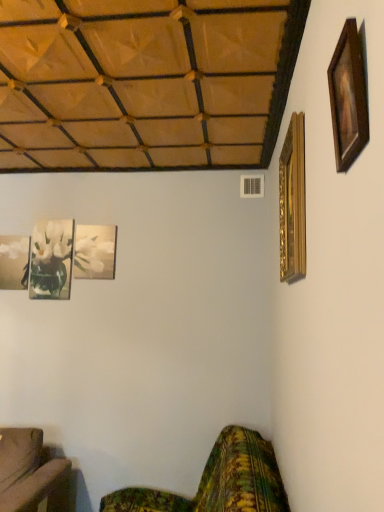
Question: From a real-world perspective, is green floral fabric couch at lower right physically located above or below matte glass picture frame at lower left, the second picture frame viewed from the left?

Choices:
 (A) below
 (B) above

Answer: (A)

Question: Looking at their shapes, would you say green floral fabric couch at lower right is wider or thinner than matte glass picture frame at lower left, the 2th picture frame from the back?

Choices:
 (A) wide
 (B) thin

Answer: (A)

Question: Based on their relative distances, which object is nearer to the matte glass picture frame at lower left, the second picture frame viewed from the left?

Choices:
 (A) wooden picture frame at upper right, which is counted as the fourth picture frame, starting from the left
 (B) matte glass vase at left, which appears as the first picture frame when viewed from the back
 (C) gold ornate picture frame at upper right, acting as the 5th picture frame starting from the left
 (D) white glossy picture frame at upper left, placed as the third picture frame when sorted from right to left
 (E) green floral fabric couch at lower right

Answer: (B)

Question: Which object is the farthest from the green floral fabric couch at lower right?

Choices:
 (A) white glossy picture frame at upper left, placed as the third picture frame when sorted from right to left
 (B) wooden picture frame at upper right, arranged as the first picture frame when viewed from the front
 (C) matte glass picture frame at lower left, the second picture frame viewed from the left
 (D) matte glass vase at left, the fifth picture frame from the front
 (E) gold ornate picture frame at upper right, the first picture frame positioned from the right

Answer: (D)